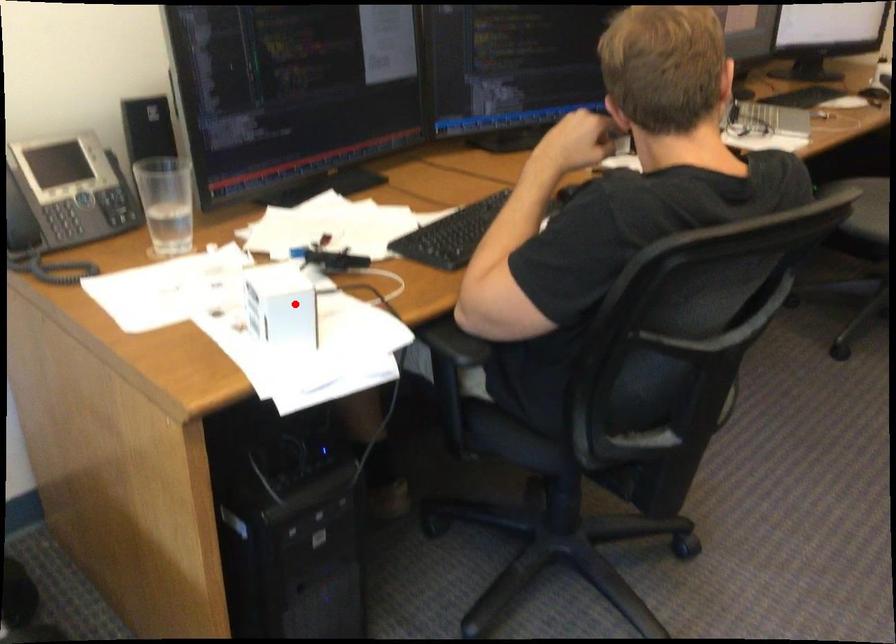
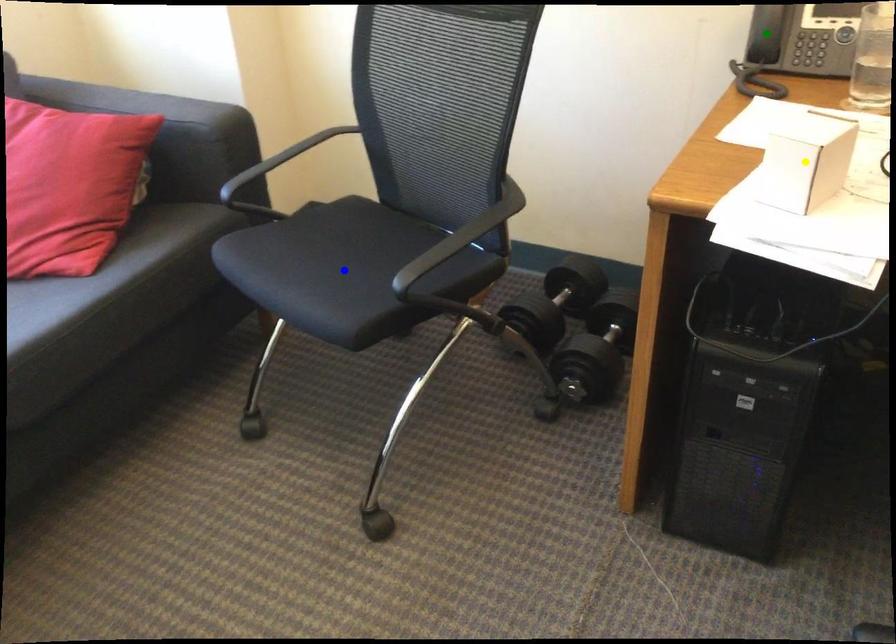
Question: I am providing you with two images of the same scene from different viewpoints. A red point is marked on the first image. You are given multiple points on the second image. Which point in image 2 is actually the same real-world point as the red point in image 1?

Choices:
 (A) yellow point
 (B) blue point
 (C) green point

Answer: (A)